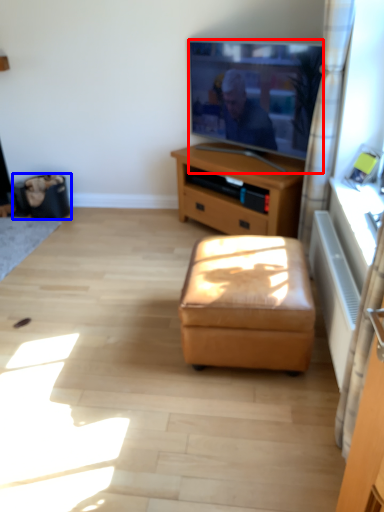
Question: Which object appears closest to the camera in this image, television (highlighted by a red box) or trash bin/can (highlighted by a blue box)?

Choices:
 (A) television
 (B) trash bin/can

Answer: (A)